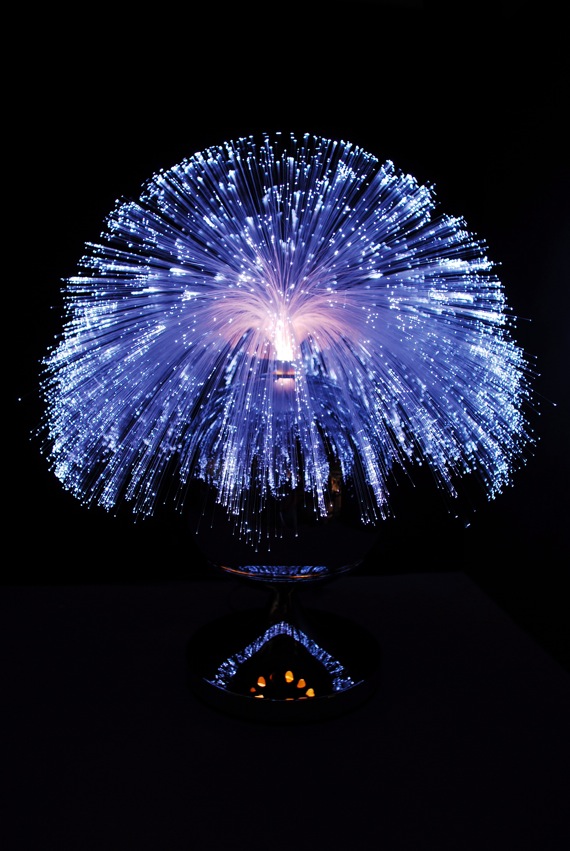
This screenshot has width=570, height=851. Identify the location of light. (284, 346).